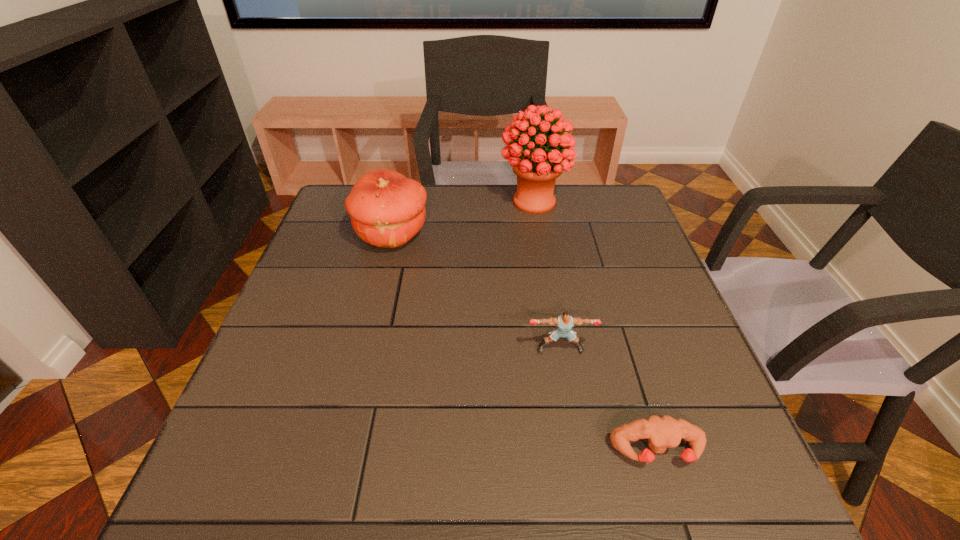
The image size is (960, 540). I want to click on blank region between the shorter puncher and the farther puncher, so click(609, 400).

Locate an element on the screen. empty location between the third shortest object and the tallest object is located at coordinates (463, 218).

Where is `object that is the third closest to the third tallest object`? The height and width of the screenshot is (540, 960). object that is the third closest to the third tallest object is located at coordinates (536, 170).

Identify which object is the third closest to the nearer puncher. Please provide its 2D coordinates. Your answer should be formatted as a tuple, i.e. [(x, y)], where the tuple contains the x and y coordinates of a point satisfying the conditions above.

[(536, 170)]